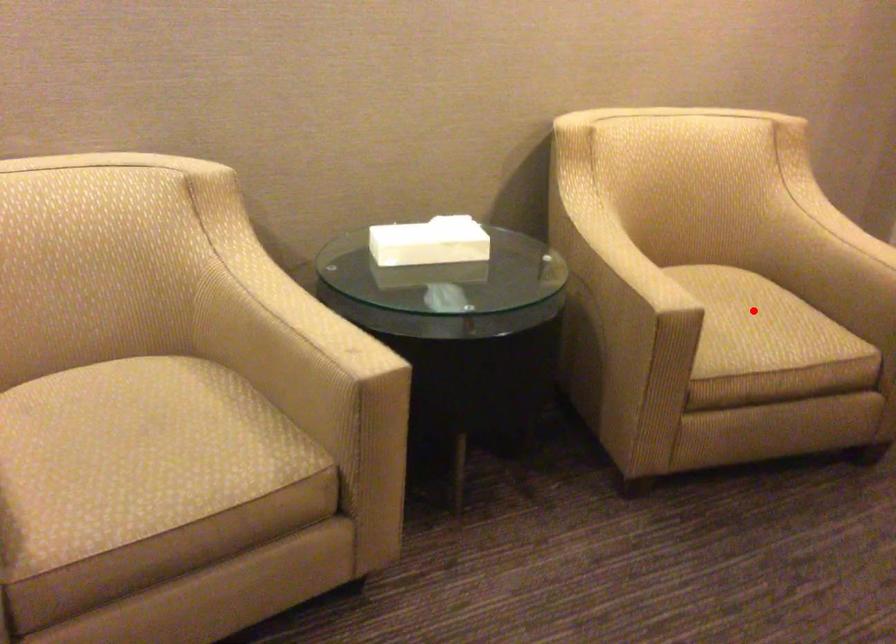
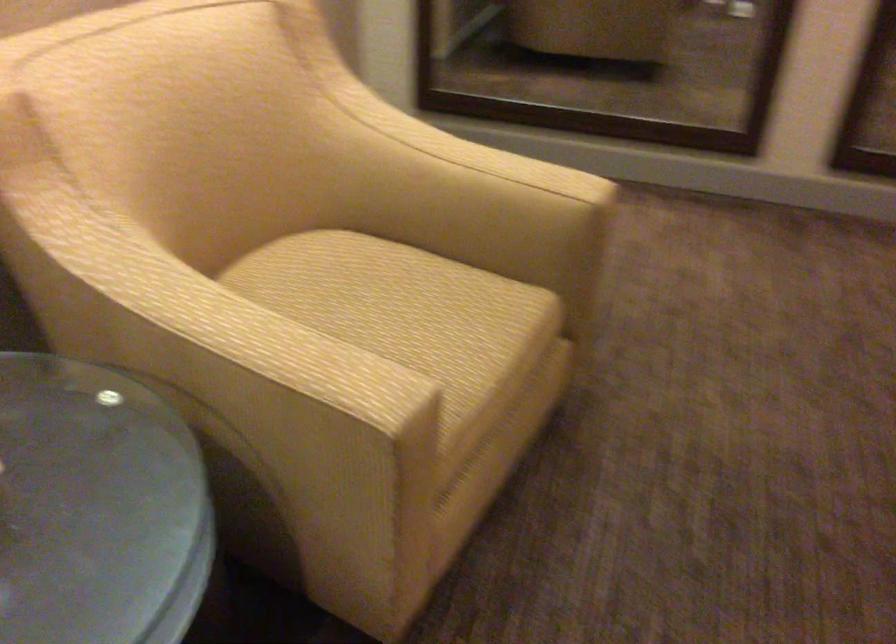
Question: A red point is marked in image1. In image2, is the corresponding 3D point closer to the camera or farther? Reply with the corresponding letter.

Choices:
 (A) The corresponding 3D point is closer.
 (B) The corresponding 3D point is farther.

Answer: (A)